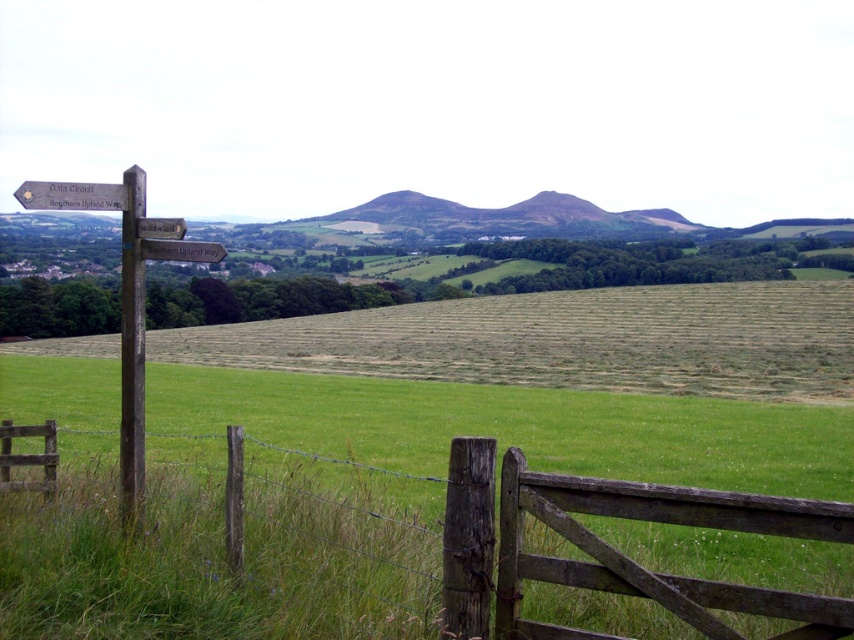
Question: Does wooden gate at lower center have a greater width compared to wooden signpost at left?

Choices:
 (A) yes
 (B) no

Answer: (B)

Question: Which is nearer to the wooden gate at lower center?

Choices:
 (A) wooden signpost at left
 (B) brown wooden post at left

Answer: (B)

Question: Does wooden signpost at left appear under brown wooden post at left?

Choices:
 (A) no
 (B) yes

Answer: (B)

Question: Can you confirm if wooden gate at lower center is positioned below brown wooden post at left?

Choices:
 (A) no
 (B) yes

Answer: (B)

Question: Which of the following is the closest to the observer?

Choices:
 (A) wooden gate at lower center
 (B) wooden signpost at left

Answer: (A)

Question: Which of the following is the closest to the observer?

Choices:
 (A) (705, 580)
 (B) (161, 220)

Answer: (A)